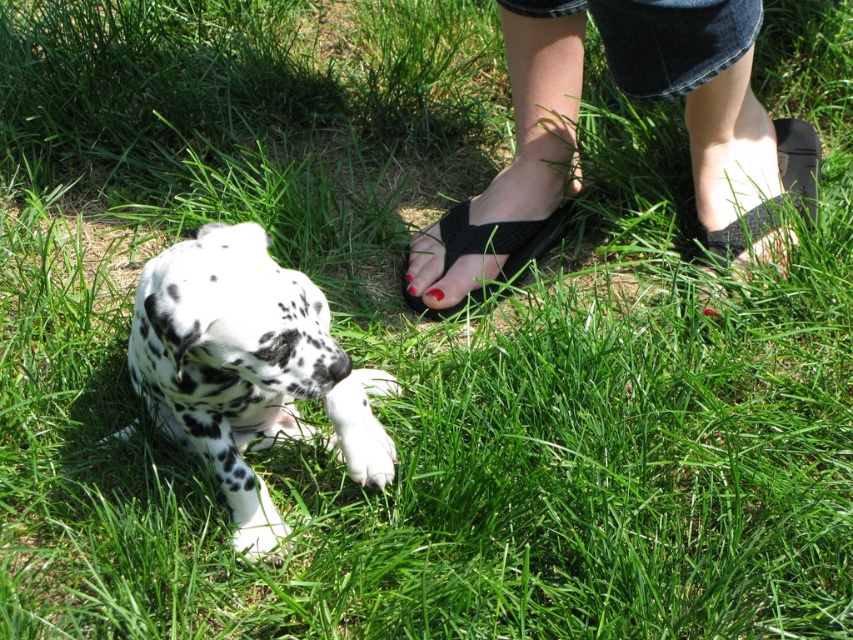
Does black fabric sandals at lower right have a larger size compared to black mesh sandal at center?

Yes, black fabric sandals at lower right is bigger than black mesh sandal at center.

Between black fabric sandals at lower right and black mesh sandal at center, which one is positioned higher?

black fabric sandals at lower right is higher up.

The image size is (853, 640). In order to click on black fabric sandals at lower right in this screenshot , I will do `click(631, 97)`.

Identify the location of black fabric sandals at lower right. The image size is (853, 640). (631, 97).

From the picture: Is black mesh sandal at center behind nail polish at center?

No, it is in front of nail polish at center.

Who is positioned more to the left, black mesh sandal at center or nail polish at center?

From the viewer's perspective, nail polish at center appears more on the left side.

Does point (531, 228) lie in front of point (431, 292)?

No, (531, 228) is behind (431, 292).

This screenshot has width=853, height=640. Find the location of `black mesh sandal at center`. black mesh sandal at center is located at coordinates (485, 250).

Is black mesh sandal at center positioned in front of matte red nail polish at center?

Yes.

Is black mesh sandal at center positioned behind matte red nail polish at center?

That is False.

You are a GUI agent. You are given a task and a screenshot of the screen. Output one action in this format:
    pyautogui.click(x=<x>, y=<y>)
    Task: Click on the black mesh sandal at center
    The width and height of the screenshot is (853, 640).
    Given the screenshot: What is the action you would take?
    pyautogui.click(x=485, y=250)

The width and height of the screenshot is (853, 640). In order to click on black mesh sandal at center in this screenshot , I will do `click(485, 250)`.